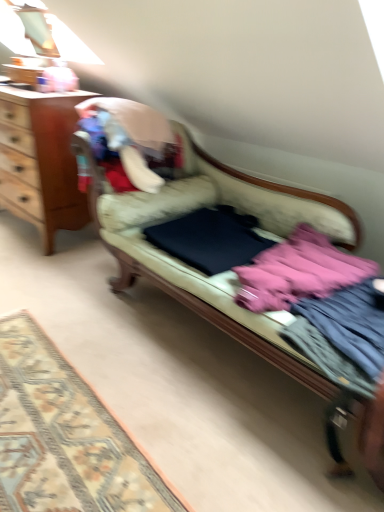
Question: Is carpeted rug at lower left smaller than velvet beige couch at center?

Choices:
 (A) yes
 (B) no

Answer: (A)

Question: Can you confirm if carpeted rug at lower left is positioned to the right of velvet beige couch at center?

Choices:
 (A) yes
 (B) no

Answer: (B)

Question: Is carpeted rug at lower left outside of velvet beige couch at center?

Choices:
 (A) no
 (B) yes

Answer: (B)

Question: Is velvet beige couch at center completely or partially inside carpeted rug at lower left?

Choices:
 (A) no
 (B) yes

Answer: (A)

Question: Can you confirm if carpeted rug at lower left is thinner than velvet beige couch at center?

Choices:
 (A) yes
 (B) no

Answer: (B)

Question: From a real-world perspective, is carpeted rug at lower left physically below velvet beige couch at center?

Choices:
 (A) yes
 (B) no

Answer: (A)

Question: Is wooden desk at left placed right next to pink fabric at right, positioned as the first clothing in front-to-back order?

Choices:
 (A) yes
 (B) no

Answer: (B)

Question: Is pink fabric at right, acting as the 2th clothing starting from the back, surrounded by wooden desk at left?

Choices:
 (A) yes
 (B) no

Answer: (B)

Question: Is wooden desk at left thinner than pink fabric at right, positioned as the first clothing in front-to-back order?

Choices:
 (A) no
 (B) yes

Answer: (B)

Question: Does wooden desk at left have a greater width compared to pink fabric at right, acting as the 2th clothing starting from the back?

Choices:
 (A) no
 (B) yes

Answer: (A)

Question: From a real-world perspective, is wooden desk at left beneath pink fabric at right, acting as the 2th clothing starting from the back?

Choices:
 (A) no
 (B) yes

Answer: (A)

Question: Is wooden desk at left behind pink fabric at right, positioned as the first clothing in front-to-back order?

Choices:
 (A) no
 (B) yes

Answer: (B)

Question: From a real-world perspective, is velvet beige couch at center located higher than wooden desk at left?

Choices:
 (A) no
 (B) yes

Answer: (A)